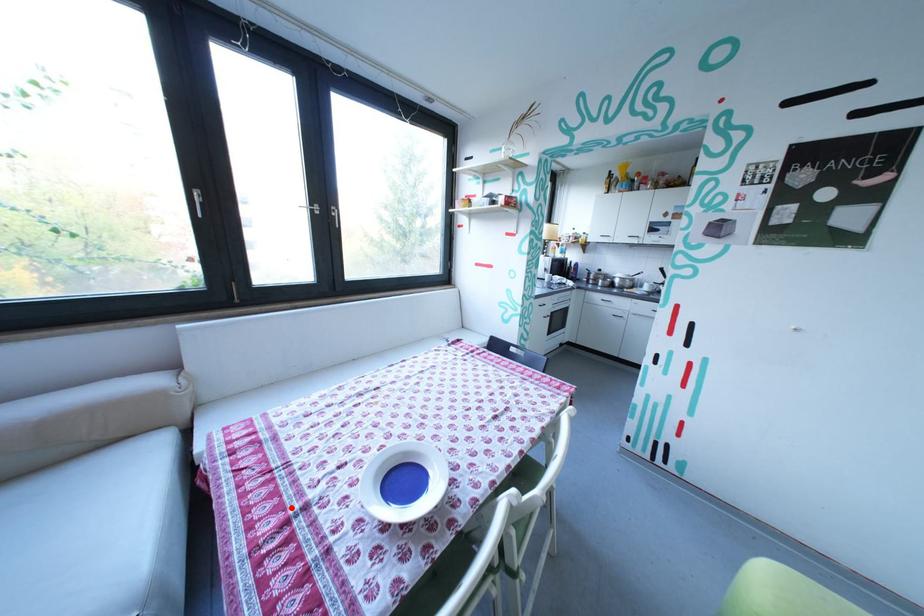
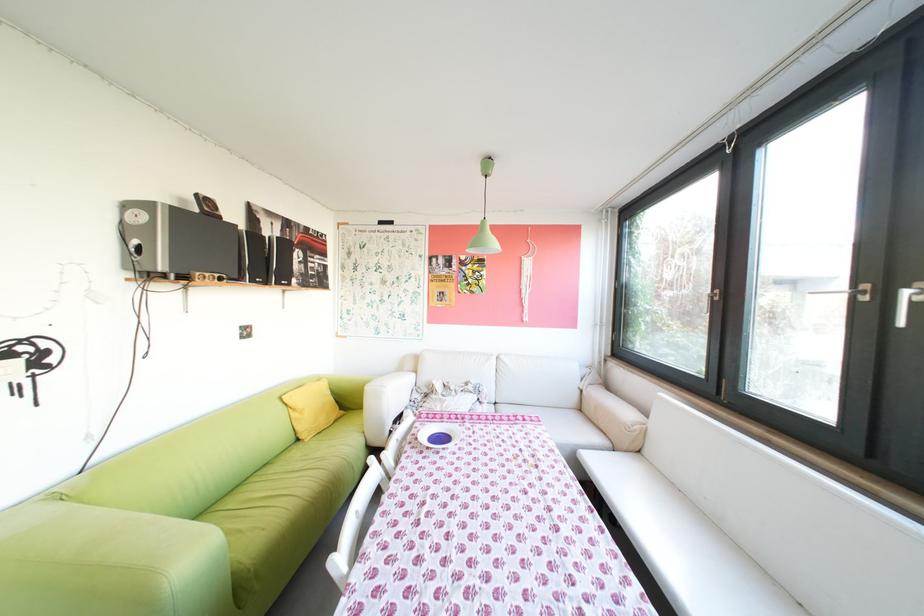
Locate, in the second image, the point that corresponds to the highlighted location in the first image.

(484, 419)